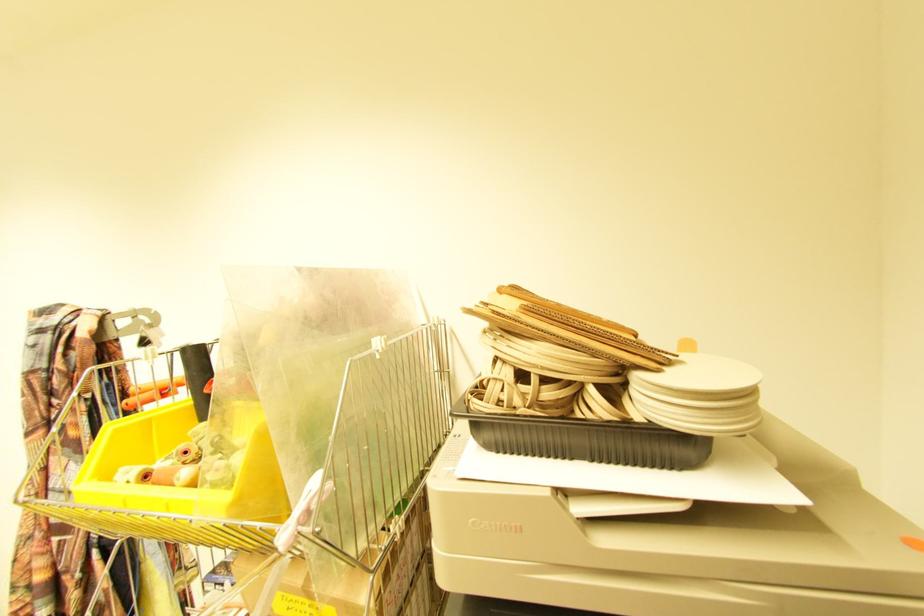
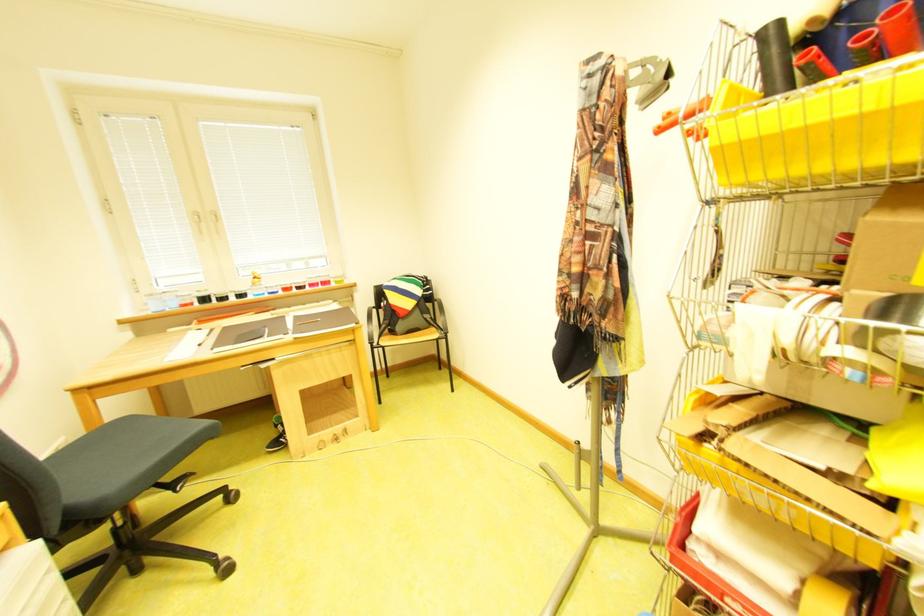
Find the pixel in the second image that matches (x=134, y=323) in the first image.

(646, 74)